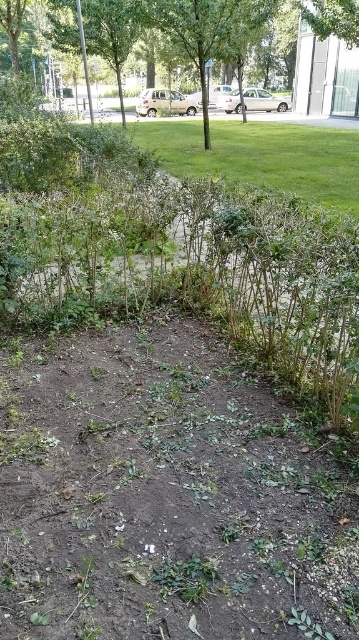
Which of these two, green leafy tree at upper center or green leafy tree at center, stands taller?

green leafy tree at center is taller.

Does green leafy tree at upper center have a greater height compared to green leafy tree at center?

Incorrect, green leafy tree at upper center's height is not larger of green leafy tree at center's.

Identify the location of green leafy tree at upper center. The height and width of the screenshot is (640, 359). (160, 29).

Find the location of a particular element. This screenshot has width=359, height=640. green leafy tree at upper center is located at coordinates (160, 29).